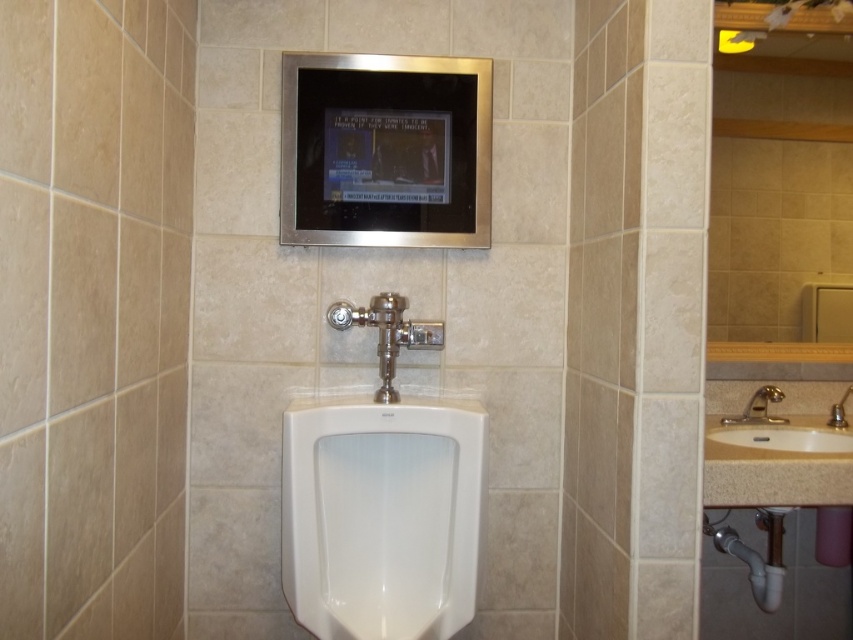
Which is behind, point (730, 436) or point (780, 394)?

The point (780, 394) is behind.

Is point (814, 451) positioned behind point (775, 422)?

No, (814, 451) is closer to viewer.

Find the location of a particular element. Image resolution: width=853 pixels, height=640 pixels. white ceramic sink at right is located at coordinates (779, 438).

Is white glossy urinal at center taller than white ceramic sink at right?

Correct, white glossy urinal at center is much taller as white ceramic sink at right.

In order to click on white glossy urinal at center in this screenshot , I will do `click(381, 516)`.

Is point (384, 577) behind point (795, 429)?

No, it is in front of (795, 429).

Image resolution: width=853 pixels, height=640 pixels. I want to click on white glossy urinal at center, so click(x=381, y=516).

Which is above, white glossy urinal at center or gold metallic faucet at right?

gold metallic faucet at right

Can you confirm if white glossy urinal at center is positioned to the right of gold metallic faucet at right?

Incorrect, white glossy urinal at center is not on the right side of gold metallic faucet at right.

Between point (381, 442) and point (747, 413), which one is positioned behind?

Positioned behind is point (747, 413).

Image resolution: width=853 pixels, height=640 pixels. Find the location of `white glossy urinal at center`. white glossy urinal at center is located at coordinates (381, 516).